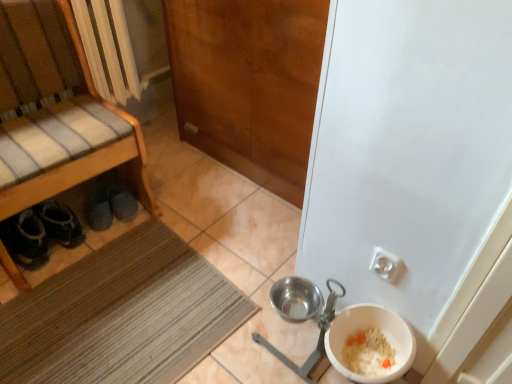
Question: From the image's perspective, is wooden bench at left on top of white plastic bowl at lower right?

Choices:
 (A) yes
 (B) no

Answer: (A)

Question: From the image's perspective, is wooden bench at left located beneath white plastic bowl at lower right?

Choices:
 (A) no
 (B) yes

Answer: (A)

Question: Does wooden bench at left have a greater width compared to white plastic bowl at lower right?

Choices:
 (A) no
 (B) yes

Answer: (B)

Question: Is wooden bench at left positioned before white plastic bowl at lower right?

Choices:
 (A) no
 (B) yes

Answer: (B)

Question: Is wooden bench at left completely or partially outside of white plastic bowl at lower right?

Choices:
 (A) yes
 (B) no

Answer: (A)

Question: Is white plastic bowl at lower right in front of or behind dark gray fabric shoes at lower left in the image?

Choices:
 (A) front
 (B) behind

Answer: (A)

Question: In terms of width, does white plastic bowl at lower right look wider or thinner when compared to dark gray fabric shoes at lower left?

Choices:
 (A) wide
 (B) thin

Answer: (B)

Question: Is point (342, 360) positioned closer to the camera than point (93, 206)?

Choices:
 (A) closer
 (B) farther

Answer: (A)

Question: From a real-world perspective, relative to dark gray fabric shoes at lower left, is white plastic bowl at lower right vertically above or below?

Choices:
 (A) above
 (B) below

Answer: (A)

Question: Is brown textured mat at lower left taller or shorter than white plastic bowl at lower right?

Choices:
 (A) tall
 (B) short

Answer: (B)

Question: From a real-world perspective, is brown textured mat at lower left positioned above or below white plastic bowl at lower right?

Choices:
 (A) above
 (B) below

Answer: (B)

Question: Looking at their shapes, would you say brown textured mat at lower left is wider or thinner than white plastic bowl at lower right?

Choices:
 (A) wide
 (B) thin

Answer: (A)

Question: Do you think brown textured mat at lower left is within white plastic bowl at lower right, or outside of it?

Choices:
 (A) outside
 (B) inside

Answer: (A)

Question: Is white plastic bowl at lower right taller or shorter than wooden bench at left?

Choices:
 (A) tall
 (B) short

Answer: (B)

Question: Considering their positions, is white plastic bowl at lower right located in front of or behind wooden bench at left?

Choices:
 (A) front
 (B) behind

Answer: (B)